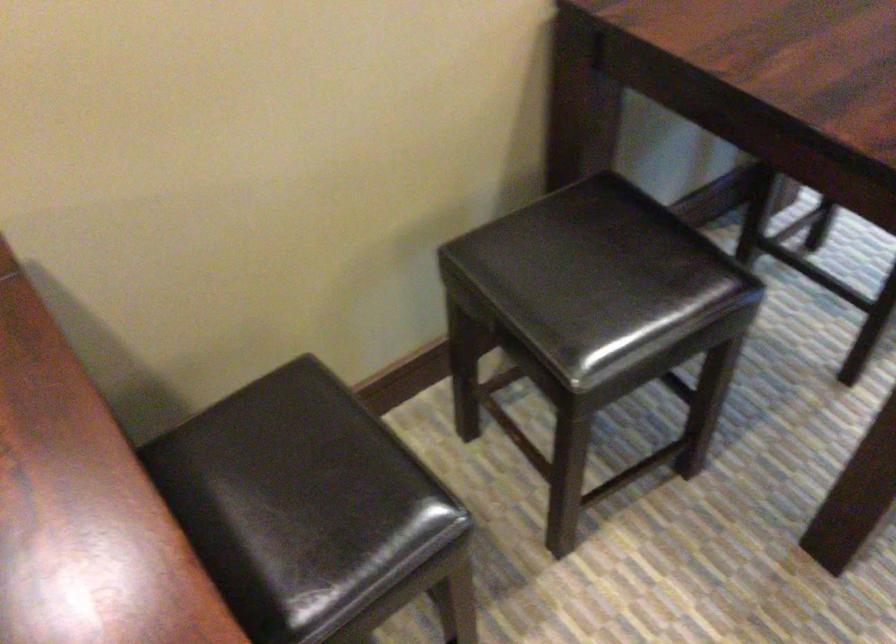
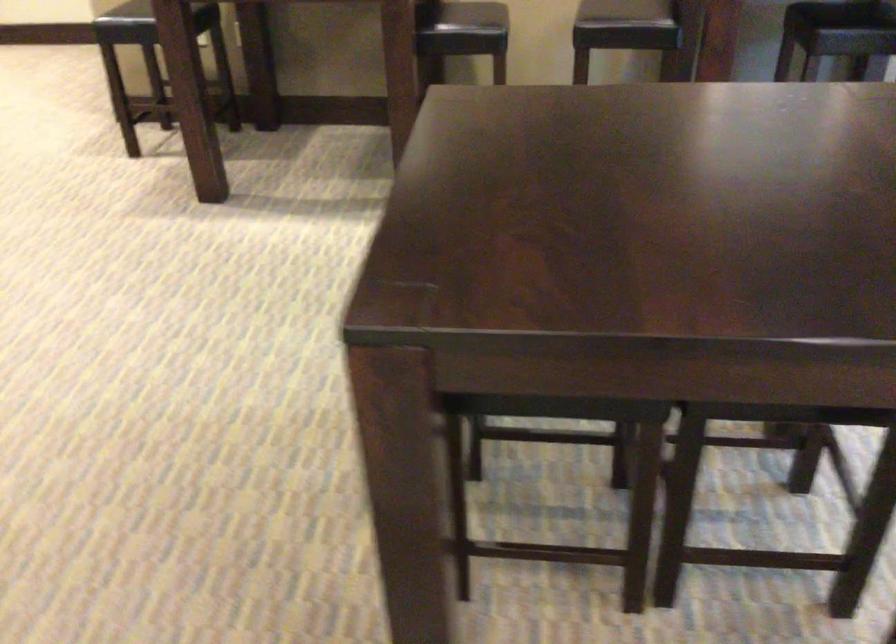
In the second image, find the point that corresponds to (x=367, y=574) in the first image.

(464, 29)